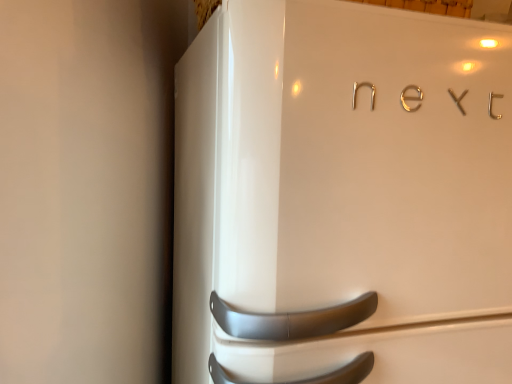
This screenshot has width=512, height=384. Describe the element at coordinates (343, 196) in the screenshot. I see `white glossy refrigerator at center` at that location.

What is the approximate height of white glossy refrigerator at center?

It is 1.05 meters.

Where is `white glossy refrigerator at center`? The width and height of the screenshot is (512, 384). white glossy refrigerator at center is located at coordinates (343, 196).

Find the location of a particular element. Image resolution: width=512 pixels, height=384 pixels. white glossy refrigerator at center is located at coordinates (343, 196).